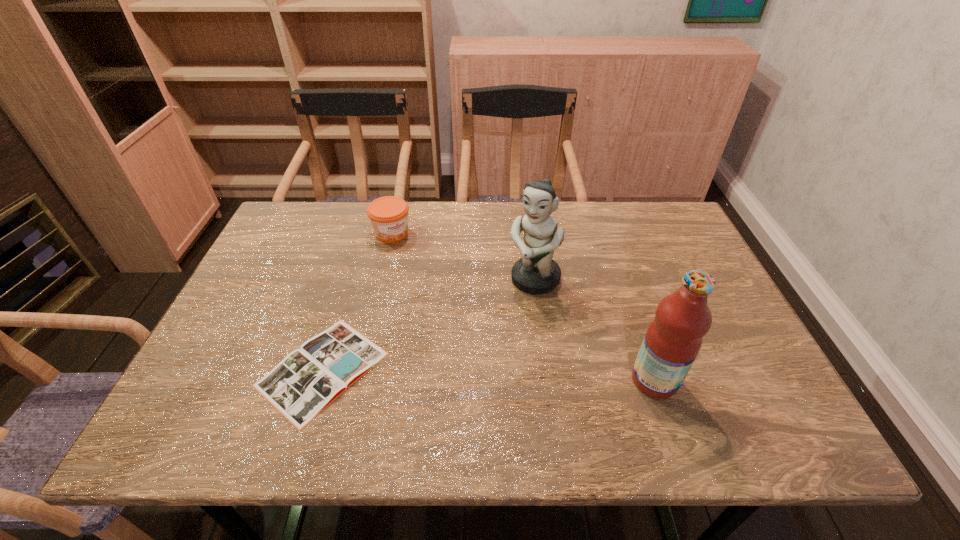
Identify the location of vacant region between the jam and the figurine. The height and width of the screenshot is (540, 960). (463, 256).

The width and height of the screenshot is (960, 540). Find the location of `free spot between the second shortest object and the shortest object`. free spot between the second shortest object and the shortest object is located at coordinates (357, 301).

Where is `unoccupied area between the third nearest object and the jam`? The height and width of the screenshot is (540, 960). unoccupied area between the third nearest object and the jam is located at coordinates (463, 256).

This screenshot has width=960, height=540. I want to click on vacant area between the figurine and the shortest object, so click(x=428, y=325).

Locate an element on the screen. object that is the third nearest to the second shortest object is located at coordinates (x=673, y=339).

Locate which object is the second closest to the second farthest object. Please provide its 2D coordinates. Your answer should be formatted as a tuple, i.e. [(x, y)], where the tuple contains the x and y coordinates of a point satisfying the conditions above.

[(389, 215)]

This screenshot has height=540, width=960. I want to click on blank area in the image that satisfies the following two spatial constraints: 1. on the front side of the shortest object; 2. on the front label of the rightmost object, so click(320, 380).

Locate an element on the screen. free space that satisfies the following two spatial constraints: 1. on the back side of the book; 2. on the left side of the jam is located at coordinates (365, 233).

Where is `vacant region that satisfies the following two spatial constraints: 1. on the front side of the rightmost object; 2. on the front label of the jam`? The height and width of the screenshot is (540, 960). vacant region that satisfies the following two spatial constraints: 1. on the front side of the rightmost object; 2. on the front label of the jam is located at coordinates [357, 380].

Find the location of a particular element. The width and height of the screenshot is (960, 540). vacant space that satisfies the following two spatial constraints: 1. on the back side of the jam; 2. on the right side of the book is located at coordinates (365, 233).